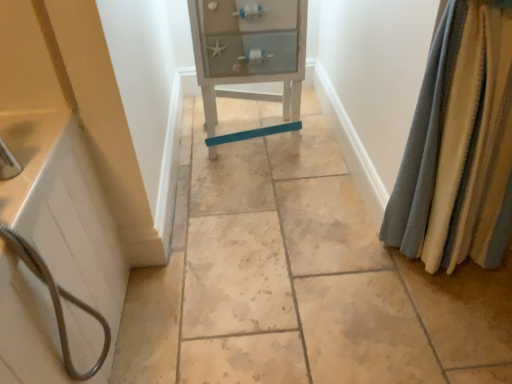
This screenshot has width=512, height=384. Find the location of `vacant region below white wood cabinet at center (from a real-world perspective)`. vacant region below white wood cabinet at center (from a real-world perspective) is located at coordinates (259, 149).